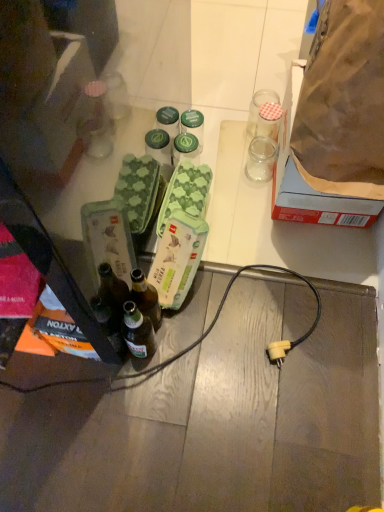
This screenshot has height=512, width=384. What do you see at coordinates (259, 106) in the screenshot?
I see `clear glass jar at upper right, which is counted as the first coffee cup, starting from the top` at bounding box center [259, 106].

Where is `transparent glass jar at upper right, the second coffee cup in the top-to-bottom sequence`? transparent glass jar at upper right, the second coffee cup in the top-to-bottom sequence is located at coordinates (261, 159).

Describe the element at coordinates (186, 149) in the screenshot. I see `green matte jar at center` at that location.

Locate an element on the screen. green cardboard egg carton at center is located at coordinates (186, 193).

You are a GUI agent. You are given a task and a screenshot of the screen. Output one action in this format:
    pyautogui.click(x=<x>, y=<y>)
    Task: Click on the brown paper bag at upper right
    The image size is (384, 512).
    Given the screenshot: What is the action you would take?
    pyautogui.click(x=315, y=180)

Between transparent glass jar at upper right, the second coffee cup in the top-to-bottom sequence, and green cardboard egg carton at center, which one appears on the right side from the viewer's perspective?

Positioned to the right is transparent glass jar at upper right, the second coffee cup in the top-to-bottom sequence.

Does transparent glass jar at upper right, which ranks as the first coffee cup in bottom-to-top order, turn towards green cardboard egg carton at center?

No, transparent glass jar at upper right, which ranks as the first coffee cup in bottom-to-top order, is not turned towards green cardboard egg carton at center.

Is transparent glass jar at upper right, which ranks as the first coffee cup in bottom-to-top order, with green cardboard egg carton at center?

No.

Which is in front, clear glass jar at upper right, which is the 2th coffee cup in bottom-to-top order, or green matte jar at center?

green matte jar at center is closer to the camera.

Considering the relative sizes of clear glass jar at upper right, which is counted as the first coffee cup, starting from the top, and green matte jar at center in the image provided, is clear glass jar at upper right, which is counted as the first coffee cup, starting from the top, thinner than green matte jar at center?

In fact, clear glass jar at upper right, which is counted as the first coffee cup, starting from the top, might be wider than green matte jar at center.

Could green matte jar at center be considered to be inside clear glass jar at upper right, which is the 2th coffee cup in bottom-to-top order?

Actually, green matte jar at center is outside clear glass jar at upper right, which is the 2th coffee cup in bottom-to-top order.

Is clear glass jar at upper right, which is the 2th coffee cup in bottom-to-top order, to the left of green matte jar at center from the viewer's perspective?

Incorrect, clear glass jar at upper right, which is the 2th coffee cup in bottom-to-top order, is not on the left side of green matte jar at center.

In the scene shown: Would you say green cardboard egg carton at center is inside or outside clear glass jar at upper right, which is the 2th coffee cup in bottom-to-top order?

green cardboard egg carton at center is not inside clear glass jar at upper right, which is the 2th coffee cup in bottom-to-top order, it's outside.

Is green cardboard egg carton at center smaller than clear glass jar at upper right, which is counted as the first coffee cup, starting from the top?

Incorrect, green cardboard egg carton at center is not smaller in size than clear glass jar at upper right, which is counted as the first coffee cup, starting from the top.

Is green cardboard egg carton at center taller than clear glass jar at upper right, which is counted as the first coffee cup, starting from the top?

In fact, green cardboard egg carton at center may be shorter than clear glass jar at upper right, which is counted as the first coffee cup, starting from the top.

In the scene shown: Is green cardboard egg carton at center further to camera compared to clear glass jar at upper right, which is the 2th coffee cup in bottom-to-top order?

No, it is in front of clear glass jar at upper right, which is the 2th coffee cup in bottom-to-top order.

Based on the photo, what's the angular difference between brown paper bag at upper right and clear glass jar at upper right, which is counted as the first coffee cup, starting from the top,'s facing directions?

0.00087 degrees.

Does brown paper bag at upper right appear on the left side of clear glass jar at upper right, which is counted as the first coffee cup, starting from the top?

Incorrect, brown paper bag at upper right is not on the left side of clear glass jar at upper right, which is counted as the first coffee cup, starting from the top.

Is brown paper bag at upper right bigger or smaller than clear glass jar at upper right, which is the 2th coffee cup in bottom-to-top order?

brown paper bag at upper right is bigger than clear glass jar at upper right, which is the 2th coffee cup in bottom-to-top order.

Considering the positions of objects brown paper bag at upper right and clear glass jar at upper right, which is the 2th coffee cup in bottom-to-top order, in the image provided, who is in front, brown paper bag at upper right or clear glass jar at upper right, which is the 2th coffee cup in bottom-to-top order,?

brown paper bag at upper right is more forward.

Is clear glass jar at upper right, which is the 2th coffee cup in bottom-to-top order, inside or outside of brown paper bag at upper right?

clear glass jar at upper right, which is the 2th coffee cup in bottom-to-top order, exists outside the volume of brown paper bag at upper right.

Is clear glass jar at upper right, which is counted as the first coffee cup, starting from the top, placed right next to brown paper bag at upper right?

No, clear glass jar at upper right, which is counted as the first coffee cup, starting from the top, is not touching brown paper bag at upper right.

From a real-world perspective, which is physically above, clear glass jar at upper right, which is the 2th coffee cup in bottom-to-top order, or brown paper bag at upper right?

brown paper bag at upper right is physically above.

Is point (270, 97) positioned in front of point (301, 77)?

That is False.

Between clear glass jar at upper right, which is counted as the first coffee cup, starting from the top, and green cardboard egg carton at center, which one is positioned in front?

green cardboard egg carton at center.

Is point (262, 100) farther from camera compared to point (186, 193)?

That is True.

From the image's perspective, is clear glass jar at upper right, which is the 2th coffee cup in bottom-to-top order, positioned above or below green cardboard egg carton at center?

clear glass jar at upper right, which is the 2th coffee cup in bottom-to-top order, is situated higher than green cardboard egg carton at center in the image.

Does clear glass jar at upper right, which is counted as the first coffee cup, starting from the top, have a lesser height compared to green cardboard egg carton at center?

No, clear glass jar at upper right, which is counted as the first coffee cup, starting from the top, is not shorter than green cardboard egg carton at center.

From a real-world perspective, which object stands above the other?

green cardboard egg carton at center is physically above.

Between green cardboard egg carton at center and green matte jar at center, which one appears on the left side from the viewer's perspective?

green cardboard egg carton at center.

Find the location of a particular element. This screenshot has width=384, height=512. food that is above the green matte jar at center (from a real-world perspective) is located at coordinates (186, 193).

Image resolution: width=384 pixels, height=512 pixels. I want to click on coffee cup that is the 1st one when counting upward from the green cardboard egg carton at center (from the image's perspective), so click(261, 159).

Locate an element on the screen. The image size is (384, 512). coffee cup that appears behind the green matte jar at center is located at coordinates [259, 106].

Based on their spatial positions, is clear glass jar at upper right, which is the 2th coffee cup in bottom-to-top order, or transparent glass jar at upper right, which ranks as the first coffee cup in bottom-to-top order, further from brown paper bag at upper right?

Among the two, clear glass jar at upper right, which is the 2th coffee cup in bottom-to-top order, is located further to brown paper bag at upper right.

When comparing their distances from green matte jar at center, does clear glass jar at upper right, which is the 2th coffee cup in bottom-to-top order, or transparent glass jar at upper right, the second coffee cup in the top-to-bottom sequence, seem further?

clear glass jar at upper right, which is the 2th coffee cup in bottom-to-top order, is further to green matte jar at center.

Considering their positions, is transparent glass jar at upper right, which ranks as the first coffee cup in bottom-to-top order, positioned closer to green matte jar at center than brown paper bag at upper right?

Based on the image, transparent glass jar at upper right, which ranks as the first coffee cup in bottom-to-top order, appears to be nearer to green matte jar at center.

Looking at the image, which one is located further to green cardboard egg carton at center, transparent glass jar at upper right, which ranks as the first coffee cup in bottom-to-top order, or brown paper bag at upper right?

brown paper bag at upper right lies further to green cardboard egg carton at center than the other object.

When comparing their distances from transparent glass jar at upper right, which ranks as the first coffee cup in bottom-to-top order, does clear glass jar at upper right, which is counted as the first coffee cup, starting from the top, or green cardboard egg carton at center seem further?

green cardboard egg carton at center is further to transparent glass jar at upper right, which ranks as the first coffee cup in bottom-to-top order.

Estimate the real-world distances between objects in this image. Which object is further from green matte jar at center, transparent glass jar at upper right, which ranks as the first coffee cup in bottom-to-top order, or green cardboard egg carton at center?

Among the two, transparent glass jar at upper right, which ranks as the first coffee cup in bottom-to-top order, is located further to green matte jar at center.

Which object lies nearer to the anchor point green cardboard egg carton at center, brown paper bag at upper right or green matte jar at center?

green matte jar at center is closer to green cardboard egg carton at center.

From the image, which object appears to be nearer to brown paper bag at upper right, green matte jar at center or green cardboard egg carton at center?

green cardboard egg carton at center.

I want to click on bottle between clear glass jar at upper right, which is the 2th coffee cup in bottom-to-top order, and green cardboard egg carton at center, in the vertical direction, so click(x=186, y=149).

The width and height of the screenshot is (384, 512). Find the location of `coffee cup situated between green matte jar at center and clear glass jar at upper right, which is the 2th coffee cup in bottom-to-top order, from left to right`. coffee cup situated between green matte jar at center and clear glass jar at upper right, which is the 2th coffee cup in bottom-to-top order, from left to right is located at coordinates (261, 159).

This screenshot has height=512, width=384. In order to click on coffee cup between clear glass jar at upper right, which is the 2th coffee cup in bottom-to-top order, and green cardboard egg carton at center vertically in this screenshot , I will do `click(261, 159)`.

Find the location of a particular element. The height and width of the screenshot is (512, 384). bottle between brown paper bag at upper right and clear glass jar at upper right, which is counted as the first coffee cup, starting from the top, in the front-back direction is located at coordinates (186, 149).